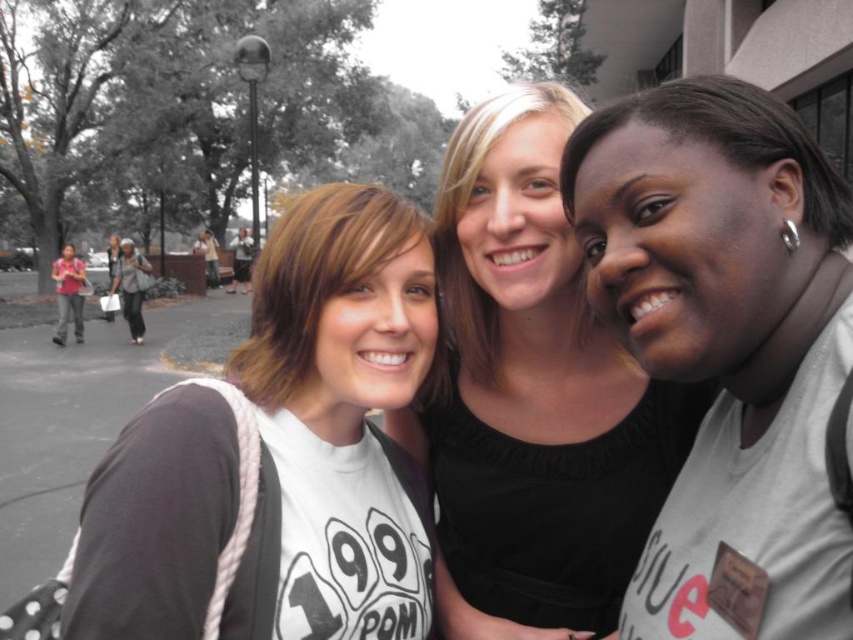
Question: Which point is closer to the camera taking this photo?

Choices:
 (A) pos(236,262)
 (B) pos(813,426)
 (C) pos(138,305)

Answer: (B)

Question: Can you confirm if matte white t-shirt at center is positioned below light brown leather jacket at center?

Choices:
 (A) no
 (B) yes

Answer: (B)

Question: Considering the real-world distances, which object is farthest from the matte white t-shirt at center?

Choices:
 (A) light gray fabric jacket at left
 (B) smooth black shirt at center

Answer: (A)

Question: Considering the real-world distances, which object is farthest from the white matte t-shirt at right?

Choices:
 (A) light brown leather jacket at center
 (B) smooth black shirt at center
 (C) light gray fabric jacket at left

Answer: (A)

Question: Is white matte t-shirt at right bigger than smooth black shirt at center?

Choices:
 (A) no
 (B) yes

Answer: (A)

Question: Does light gray fabric jacket at left appear over light brown leather jacket at center?

Choices:
 (A) yes
 (B) no

Answer: (B)